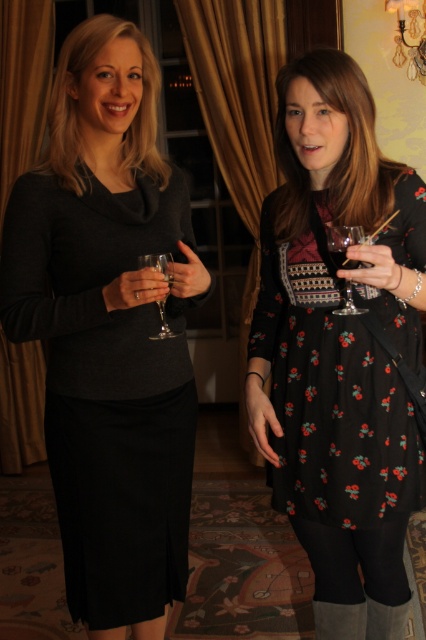
Describe the element at coordinates (339, 340) in the screenshot. I see `printed cotton dress at center` at that location.

Between point (324, 246) and point (316, 632), which one is positioned in front?

Point (324, 246) is more forward.

Is point (408, 268) closer to camera compared to point (359, 611)?

Yes, it is.

I want to click on printed cotton dress at center, so click(339, 340).

The image size is (426, 640). What do you see at coordinates (339, 620) in the screenshot? I see `leather boot at lower right` at bounding box center [339, 620].

Is point (321, 616) farther from camera compared to point (356, 240)?

Yes, it is behind point (356, 240).

This screenshot has width=426, height=640. I want to click on leather boot at lower right, so click(x=339, y=620).

Where is `transparent glass at right`? The width and height of the screenshot is (426, 640). transparent glass at right is located at coordinates (342, 243).

Is transparent glass at right thinner than clear glass wine glass at center?

No, transparent glass at right is not thinner than clear glass wine glass at center.

Where is `transparent glass at right`? The width and height of the screenshot is (426, 640). transparent glass at right is located at coordinates (342, 243).

Image resolution: width=426 pixels, height=640 pixels. I want to click on transparent glass at right, so click(342, 243).